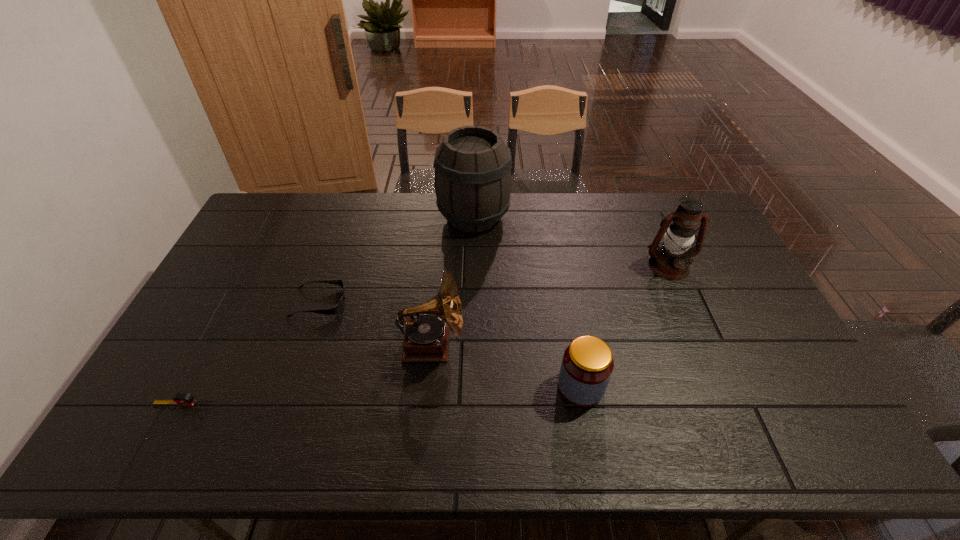
You are a GUI agent. You are given a task and a screenshot of the screen. Output one action in this format:
    pyautogui.click(x=<x>, y=<y>)
    Task: Click on the farthest object
    
    Given the screenshot: What is the action you would take?
    point(472,180)

At what (x,y) coordinates should I click in order to perform the action: click on the rightmost object. Please return your answer as a coordinate pair (x, y). Image resolution: width=960 pixels, height=540 pixels. Looking at the image, I should click on (671, 261).

Image resolution: width=960 pixels, height=540 pixels. Find the location of `lantern`. lantern is located at coordinates (671, 261).

This screenshot has height=540, width=960. Find the location of `phonograph_record`. phonograph_record is located at coordinates (426, 337).

Find the location of `the second object from right to left`. the second object from right to left is located at coordinates (587, 365).

At what (x,y) coordinates should I click in order to perform the action: click on the fourth tallest object. Please return your answer as a coordinate pair (x, y). The height and width of the screenshot is (540, 960). Looking at the image, I should click on (587, 365).

You are a GUI agent. You are given a task and a screenshot of the screen. Output one action in this format:
    pyautogui.click(x=<x>, y=<y>)
    Task: Click on the tape measure
    The image size is (960, 540).
    Given the screenshot: What is the action you would take?
    pyautogui.click(x=181, y=399)

Find the location of `the second object from left to right`. the second object from left to right is located at coordinates (338, 307).

The width and height of the screenshot is (960, 540). I want to click on the fourth nearest object, so click(338, 307).

You are a GUI agent. You are given a task and a screenshot of the screen. Output one action in this format:
    pyautogui.click(x=<x>, y=<y>)
    Task: Click on the vacant space located on the left of the wine bucket
    
    Given the screenshot: What is the action you would take?
    pyautogui.click(x=424, y=217)